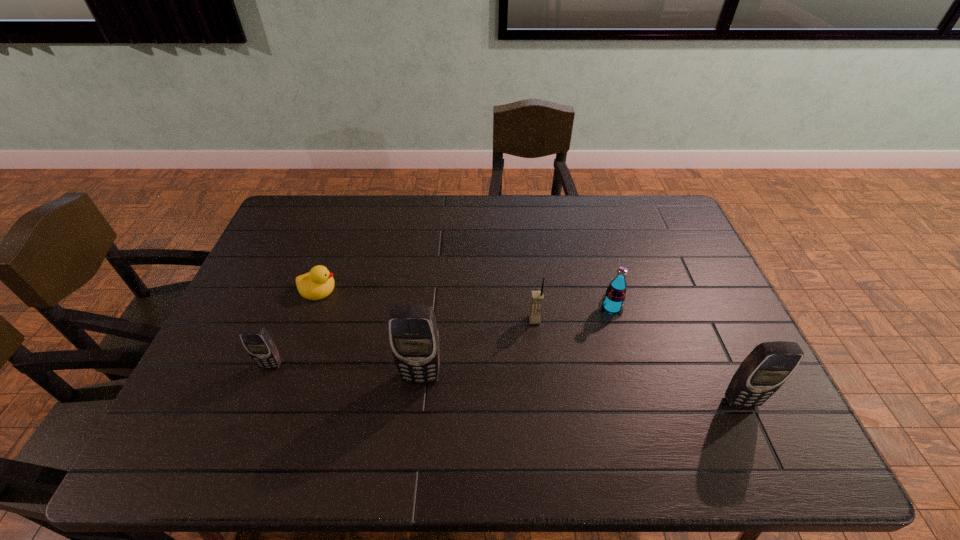
You are a GUI agent. You are given a task and a screenshot of the screen. Output one action in this format:
    pyautogui.click(x=<x>, y=<y>)
    Task: Click on the free space for an extra cellular_telephone to achieve even spacing
    The height and width of the screenshot is (540, 960).
    Given the screenshot: What is the action you would take?
    pyautogui.click(x=578, y=389)